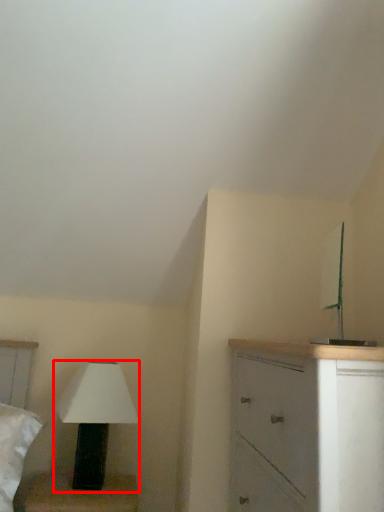
Question: From the image's perspective, where is lamp (annotated by the red box) located in relation to chest of drawers in the image?

Choices:
 (A) below
 (B) above

Answer: (A)